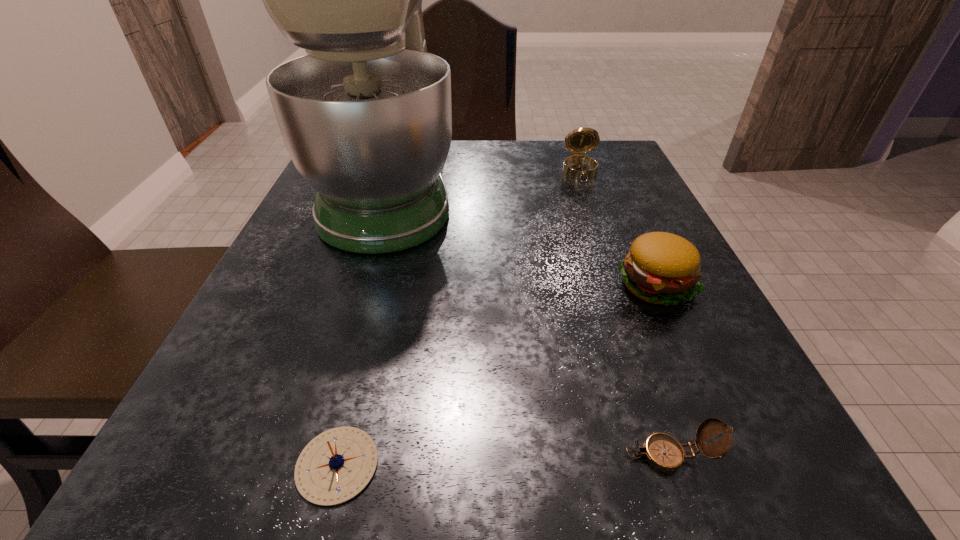
Find the location of a particular element. The image size is (960, 540). mixer is located at coordinates (x=366, y=117).

Identify the location of the farthest compass. (582, 140).

At what (x,y) coordinates should I click in order to perform the action: click on hamburger. Please return your answer as a coordinate pair (x, y). The image size is (960, 540). Looking at the image, I should click on (662, 268).

Find the location of a particular element. The height and width of the screenshot is (540, 960). the shortest compass is located at coordinates (335, 466).

I want to click on the shortest object, so click(335, 466).

The image size is (960, 540). Find the location of `free point located on the controls of the mixer`. free point located on the controls of the mixer is located at coordinates (519, 190).

Image resolution: width=960 pixels, height=540 pixels. I want to click on blank area located 0.130m with the dial facing the tallest compass, so click(x=596, y=215).

Where is `vacant space situated on the back of the hamburger`? The width and height of the screenshot is (960, 540). vacant space situated on the back of the hamburger is located at coordinates (613, 190).

Find the location of a particular element. The height and width of the screenshot is (540, 960). vacant space located 0.100m on the right of the leftmost compass is located at coordinates (468, 465).

I want to click on mixer present at the far edge, so click(x=366, y=117).